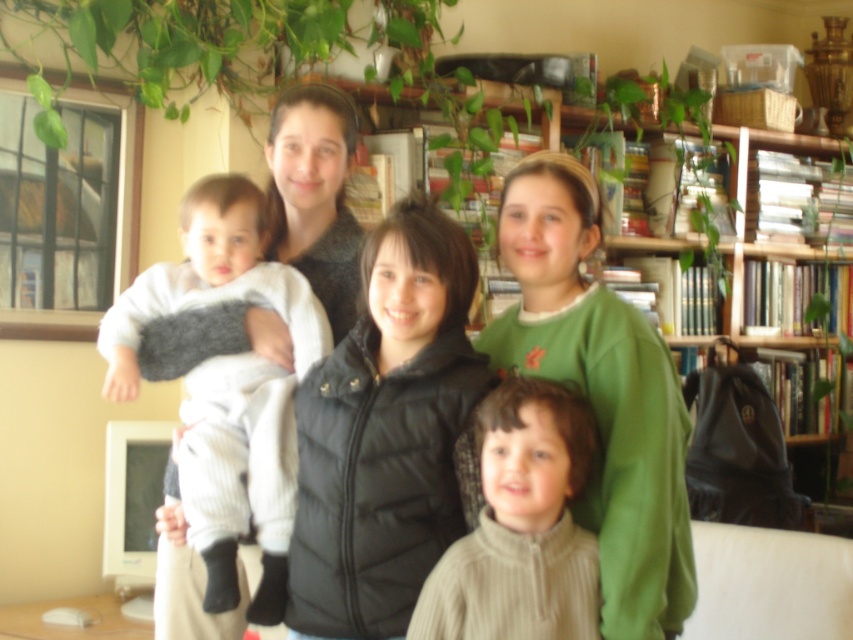
Looking at this image, you are a photographer trying to arrange the black puffer vest at center and the white soft fabric baby at left in a line for a photo. Based on their heights, which one should be placed in front to ensure both are visible in the photo?

The black puffer vest at center has a lesser height compared to the white soft fabric baby at left, so the shorter black puffer vest at center should be placed in front to ensure both are visible in the photo.